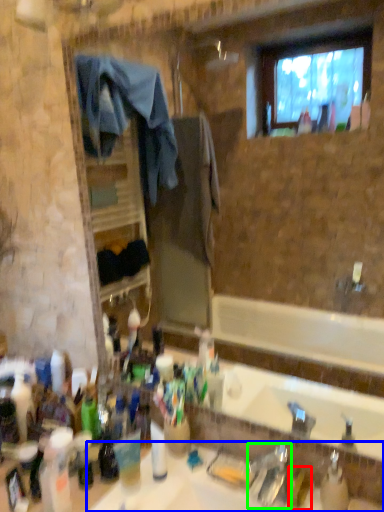
Question: Based on their relative distances, which object is nearer to toiletry (highlighted by a red box)? Choose from sink (highlighted by a blue box) and faucet (highlighted by a green box).

Choices:
 (A) sink
 (B) faucet

Answer: (B)